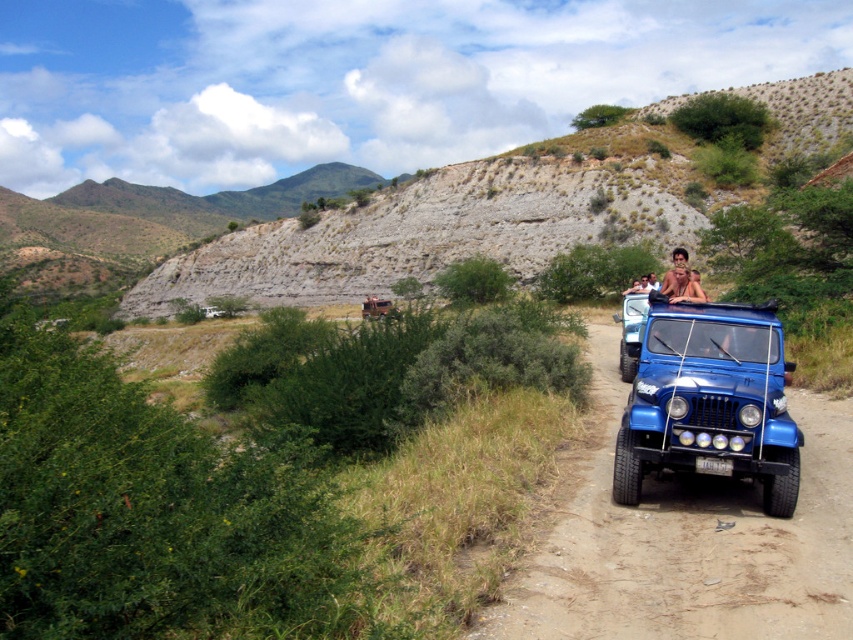
Question: Can you confirm if blue metallic jeep at center-right is smaller than brown leather jacket at center?

Choices:
 (A) no
 (B) yes

Answer: (A)

Question: Is blue metallic dirt track at center bigger than blue matte jeep at center?

Choices:
 (A) yes
 (B) no

Answer: (A)

Question: Which point is farther to the camera?

Choices:
 (A) (561, 198)
 (B) (631, 305)
 (C) (698, 288)

Answer: (A)

Question: Is blue metallic dirt track at center positioned at the back of light brown leather jacket at center?

Choices:
 (A) yes
 (B) no

Answer: (B)

Question: Which point is farther to the camera?

Choices:
 (A) (672, 296)
 (B) (712, 506)
 (C) (738, 412)
 (D) (628, 380)

Answer: (D)

Question: Which point is farther to the camera?

Choices:
 (A) (700, 288)
 (B) (595, 324)
 (C) (637, 301)

Answer: (B)